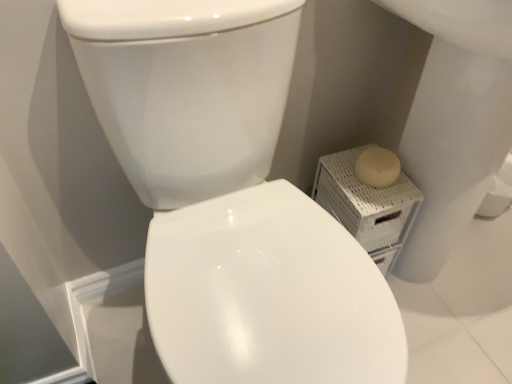
Question: Is beige wicker basket at right positioned in front of white glossy bidet at center?

Choices:
 (A) yes
 (B) no

Answer: (B)

Question: Is beige wicker basket at right oriented towards white glossy bidet at center?

Choices:
 (A) no
 (B) yes

Answer: (B)

Question: Is beige wicker basket at right to the right of white glossy bidet at center from the viewer's perspective?

Choices:
 (A) no
 (B) yes

Answer: (A)

Question: Does beige wicker basket at right have a smaller size compared to white glossy bidet at center?

Choices:
 (A) yes
 (B) no

Answer: (A)

Question: Can you confirm if beige wicker basket at right is taller than white glossy bidet at center?

Choices:
 (A) no
 (B) yes

Answer: (B)

Question: From a real-world perspective, is white glossy bidet at center above or below white glossy toilet at center?

Choices:
 (A) above
 (B) below

Answer: (B)

Question: Considering the positions of white glossy bidet at center and white glossy toilet at center in the image, is white glossy bidet at center taller or shorter than white glossy toilet at center?

Choices:
 (A) short
 (B) tall

Answer: (A)

Question: Considering the relative positions of white glossy bidet at center and white glossy toilet at center in the image provided, is white glossy bidet at center to the left or to the right of white glossy toilet at center?

Choices:
 (A) right
 (B) left

Answer: (A)

Question: In terms of size, does white glossy bidet at center appear bigger or smaller than white glossy toilet at center?

Choices:
 (A) small
 (B) big

Answer: (A)

Question: From the image's perspective, relative to beige wicker basket at right, is white glossy toilet at center above or below?

Choices:
 (A) below
 (B) above

Answer: (A)

Question: Is white glossy toilet at center taller or shorter than beige wicker basket at right?

Choices:
 (A) tall
 (B) short

Answer: (A)

Question: Considering the positions of white glossy toilet at center and beige wicker basket at right in the image, is white glossy toilet at center wider or thinner than beige wicker basket at right?

Choices:
 (A) wide
 (B) thin

Answer: (A)

Question: From a real-world perspective, is white glossy toilet at center physically located above or below beige wicker basket at right?

Choices:
 (A) below
 (B) above

Answer: (B)

Question: Considering the positions of beige wicker basket at right and white glossy bidet at center in the image, is beige wicker basket at right bigger or smaller than white glossy bidet at center?

Choices:
 (A) big
 (B) small

Answer: (B)

Question: From their relative heights in the image, would you say beige wicker basket at right is taller or shorter than white glossy bidet at center?

Choices:
 (A) tall
 (B) short

Answer: (A)